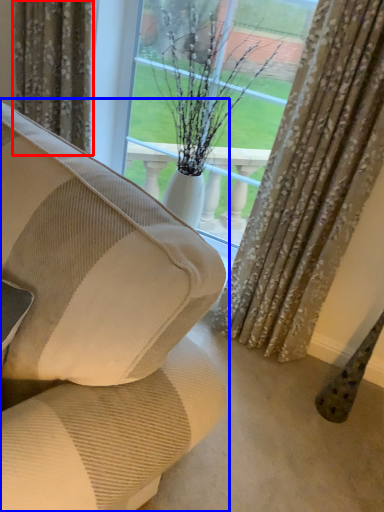
Question: Among these objects, which one is farthest to the camera, curtain (highlighted by a red box) or studio couch (highlighted by a blue box)?

Choices:
 (A) curtain
 (B) studio couch

Answer: (A)